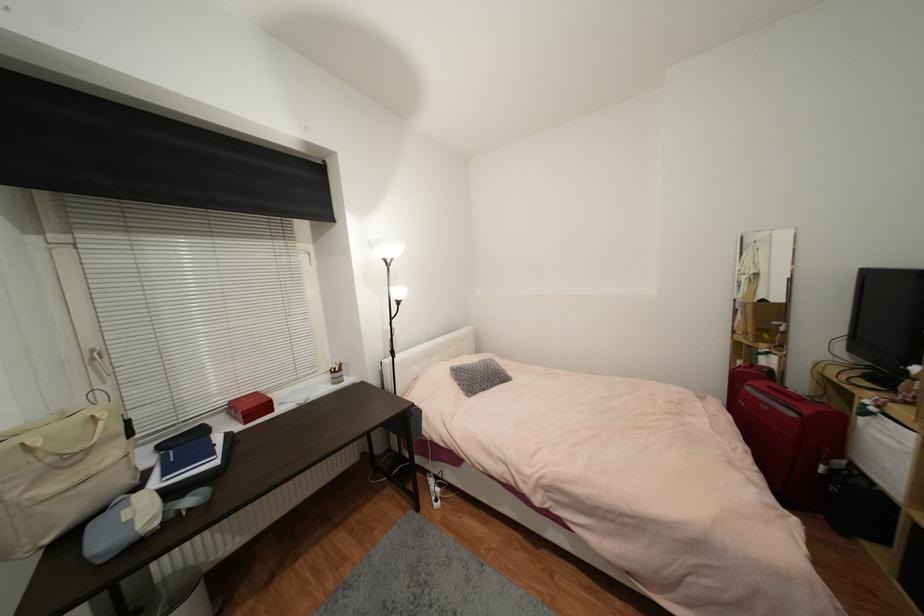
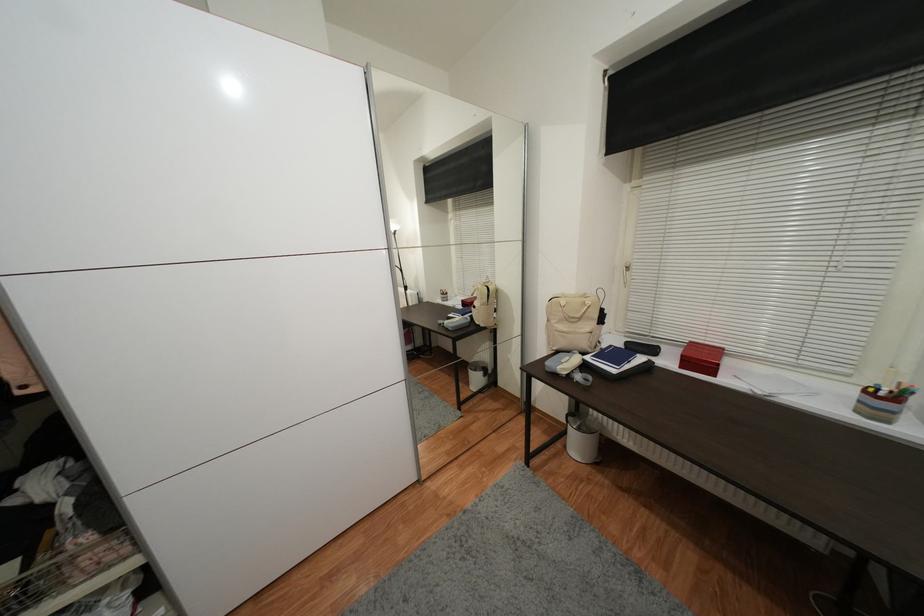
Based on the continuous images, in which direction is the camera rotating?

The camera rotated toward left-down.